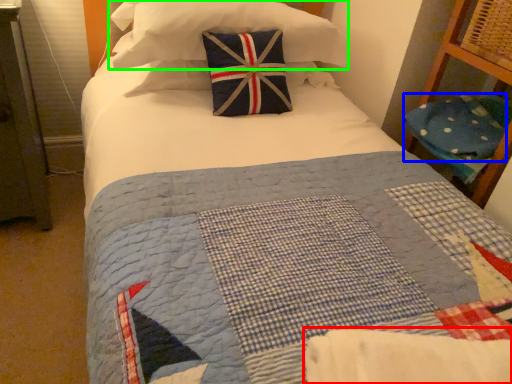
Question: Estimate the real-world distances between objects in this image. Which object is farther from blanket (highlighted by a red box), pillow (highlighted by a blue box) or pillow (highlighted by a green box)?

Choices:
 (A) pillow
 (B) pillow

Answer: (B)